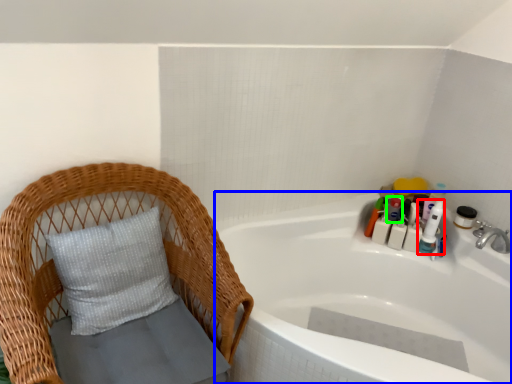
Question: Considering the real-world distances, which object is farthest from toiletry (highlighted by a red box)? bathtub (highlighted by a blue box) or toiletry (highlighted by a green box)?

Choices:
 (A) bathtub
 (B) toiletry

Answer: (A)